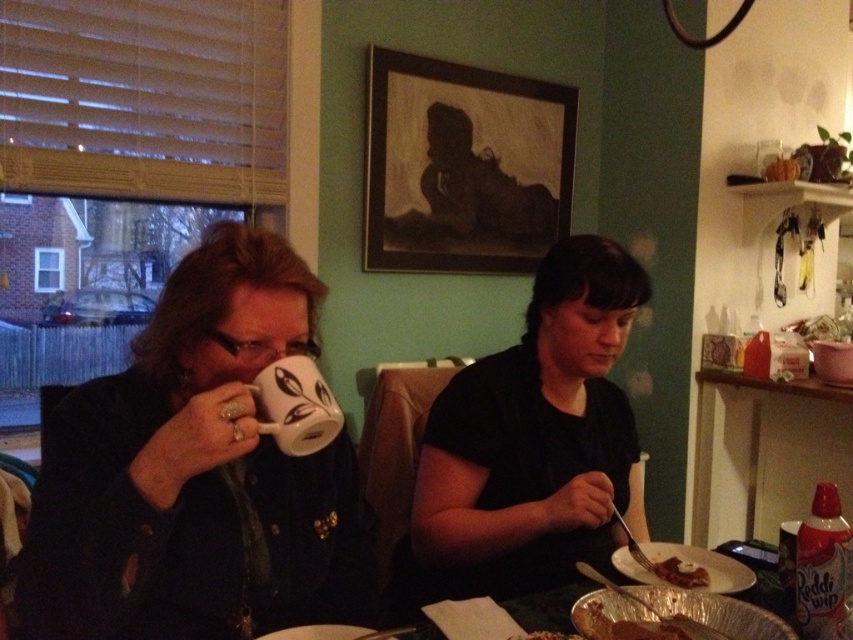
Is point (206, 284) closer to viewer compared to point (694, 573)?

That is True.

Does white glossy mug at upper left have a larger size compared to shiny silver fork at lower right?

Yes, white glossy mug at upper left is bigger than shiny silver fork at lower right.

Find the location of `white glossy mug at upper left`. white glossy mug at upper left is located at coordinates (196, 474).

Describe the element at coordinates (196, 474) in the screenshot. This screenshot has width=853, height=640. I see `white glossy mug at upper left` at that location.

The height and width of the screenshot is (640, 853). Find the location of `white glossy mug at upper left`. white glossy mug at upper left is located at coordinates (196, 474).

What do you see at coordinates (764, 451) in the screenshot? I see `metallic silver tray at right` at bounding box center [764, 451].

Does metallic silver tray at right have a lesser height compared to red matte whipped cream at lower right?

In fact, metallic silver tray at right may be taller than red matte whipped cream at lower right.

Which is behind, point (749, 490) or point (828, 554)?

Point (749, 490)

Identify the location of metallic silver tray at right. This screenshot has height=640, width=853. (764, 451).